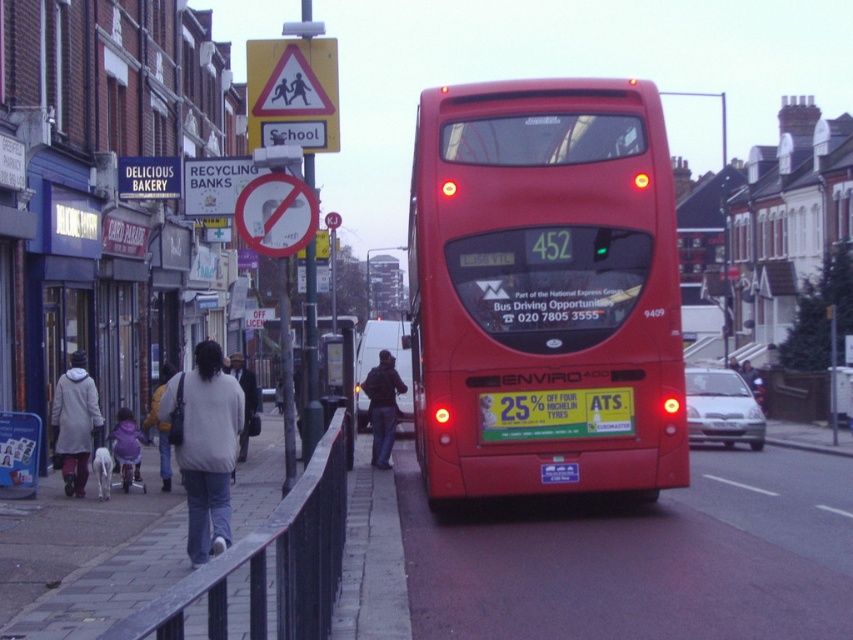
Question: Does dark red asphalt at center appear on the right side of light gray sweater at center-left?

Choices:
 (A) no
 (B) yes

Answer: (B)

Question: Can you confirm if light gray sweater at center-left is smaller than matte gray coat at lower left?

Choices:
 (A) no
 (B) yes

Answer: (B)

Question: Among these points, which one is nearest to the camera?

Choices:
 (A) (148, 408)
 (B) (387, 516)
 (C) (573, 461)

Answer: (C)

Question: Does yellowmetalliclicense plate at center have a lesser width compared to purple fleece jacket at lower left?

Choices:
 (A) yes
 (B) no

Answer: (B)

Question: Which object appears closest to the camera in this image?

Choices:
 (A) blue plastic license plate at center
 (B) dark blue jeans at center
 (C) red plastic sign at upper center

Answer: (C)

Question: Considering the real-world distances, which object is closest to the purple fleece jacket at lower left?

Choices:
 (A) blue plastic license plate at center
 (B) dark red asphalt at center
 (C) light gray sweater at center-left

Answer: (C)